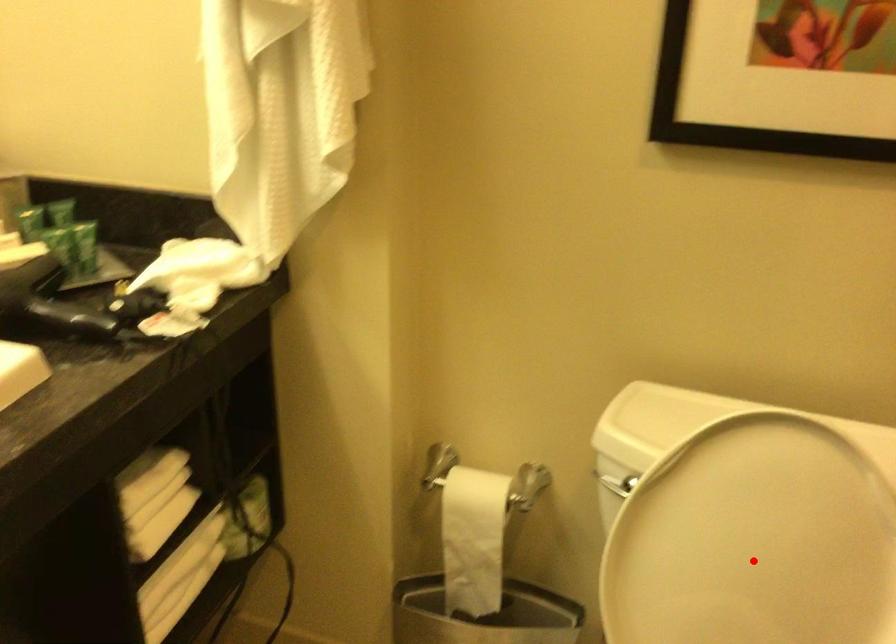
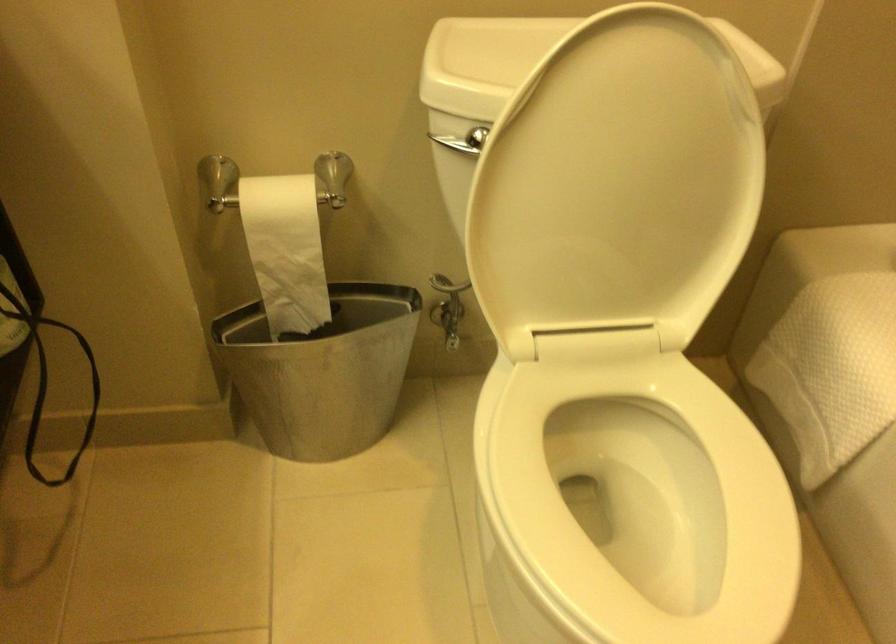
Find the pixel in the second image that matches the highlighted location in the first image.

(617, 183)